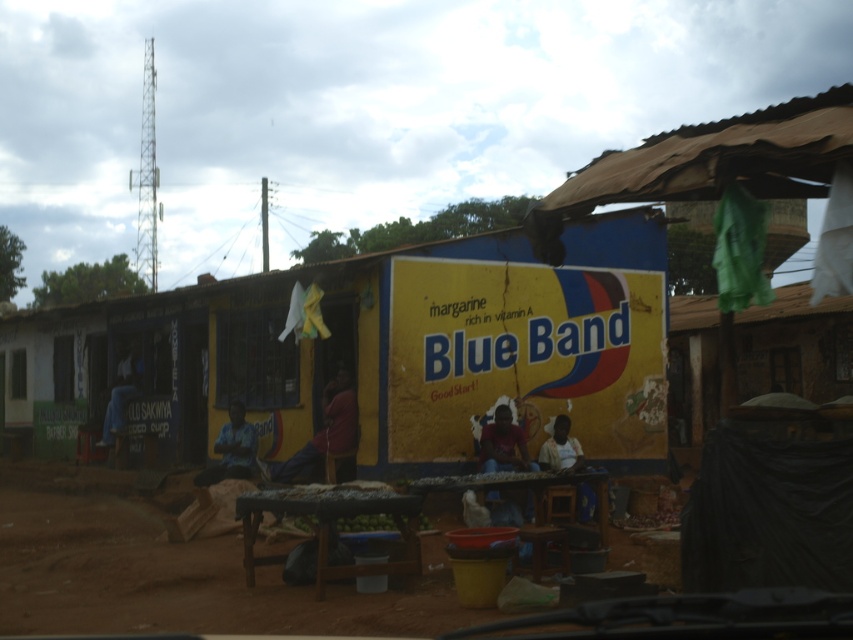
In the scene shown: Is the position of dark red fabric at center less distant than that of blue fabric shirt at center?

Yes.

Can you confirm if dark red fabric at center is smaller than blue fabric shirt at center?

No, dark red fabric at center is not smaller than blue fabric shirt at center.

Between point (329, 445) and point (222, 452), which one is positioned behind?

The point (222, 452) is more distant.

Identify the location of dark red fabric at center. (325, 432).

What do you see at coordinates (325, 432) in the screenshot?
I see `dark red fabric at center` at bounding box center [325, 432].

Which of these two, dark red fabric at center or light brown wooden stool at center, stands taller?

dark red fabric at center is taller.

What do you see at coordinates (325, 432) in the screenshot? I see `dark red fabric at center` at bounding box center [325, 432].

Image resolution: width=853 pixels, height=640 pixels. I want to click on dark red fabric at center, so click(325, 432).

Does brown dirt field at lower center appear on the right side of blue fabric shirt at left?

Yes, brown dirt field at lower center is to the right of blue fabric shirt at left.

Who is taller, brown dirt field at lower center or blue fabric shirt at left?

Standing taller between the two is blue fabric shirt at left.

Which is in front, point (422, 612) or point (120, 420)?

Point (422, 612) is more forward.

At what (x,y) coordinates should I click in order to perform the action: click on brown dirt field at lower center. Please return your answer as a coordinate pair (x, y). Image resolution: width=853 pixels, height=640 pixels. Looking at the image, I should click on (178, 573).